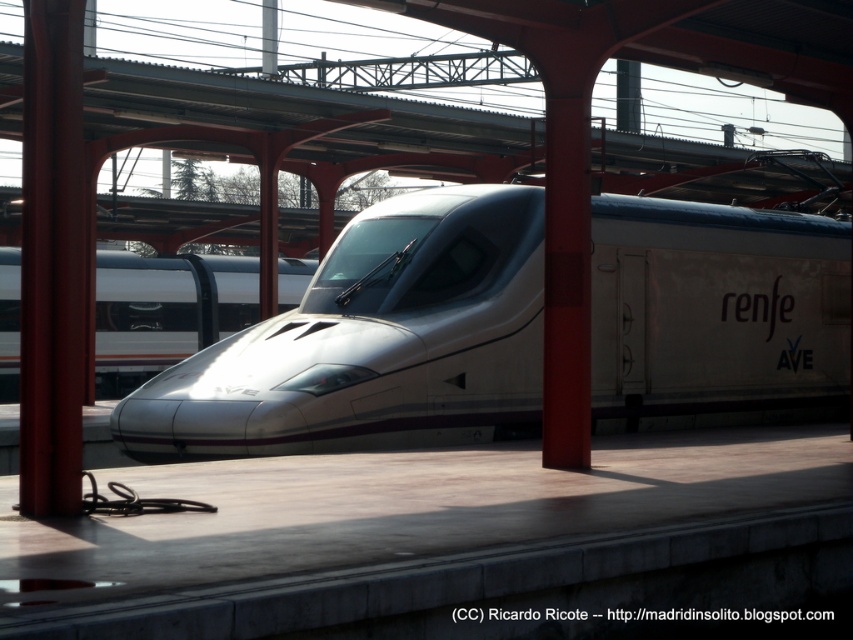
Question: Which point is farther to the camera?

Choices:
 (A) (209, 448)
 (B) (120, 324)

Answer: (B)

Question: Does sleek silver train at center have a smaller size compared to white glossy train at center?

Choices:
 (A) yes
 (B) no

Answer: (B)

Question: Which object is farther from the camera taking this photo?

Choices:
 (A) sleek silver train at center
 (B) white glossy train at center

Answer: (B)

Question: Does sleek silver train at center appear under white glossy train at center?

Choices:
 (A) yes
 (B) no

Answer: (A)

Question: Does sleek silver train at center appear on the left side of white glossy train at center?

Choices:
 (A) no
 (B) yes

Answer: (A)